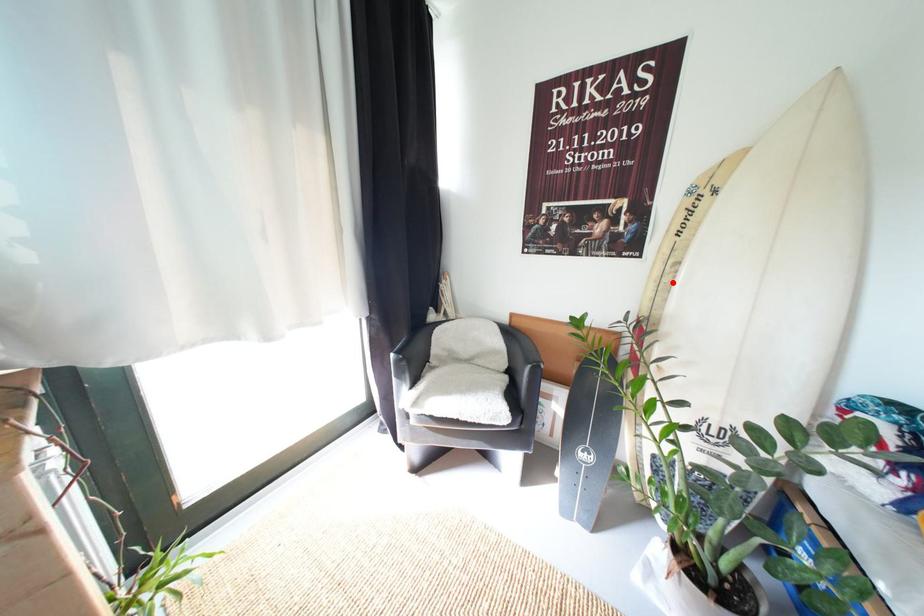
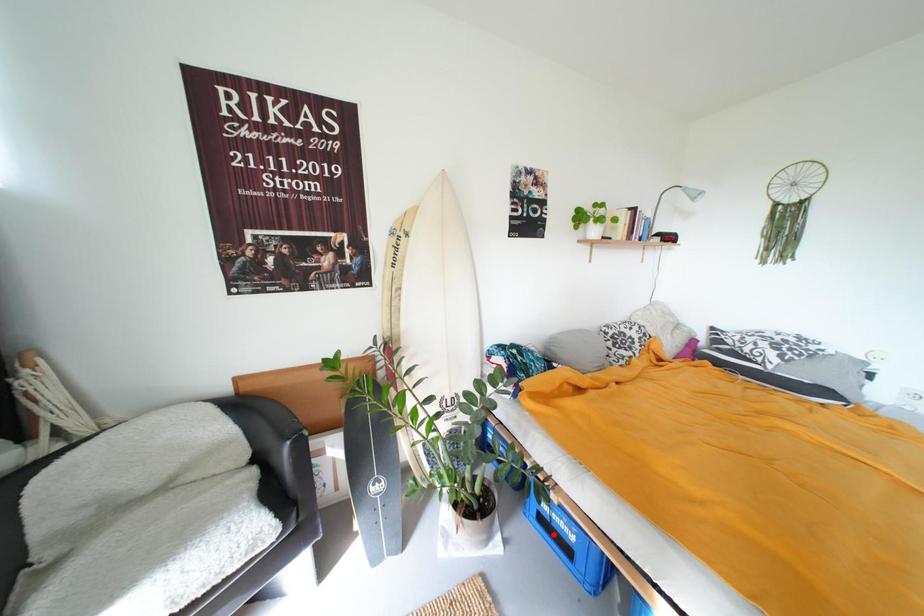
I am providing you with two images of the same scene from different viewpoints. A red point is marked on the first image and another point is marked on the second image. Do the highlighted points in image1 and image2 indicate the same real-world spot?

No